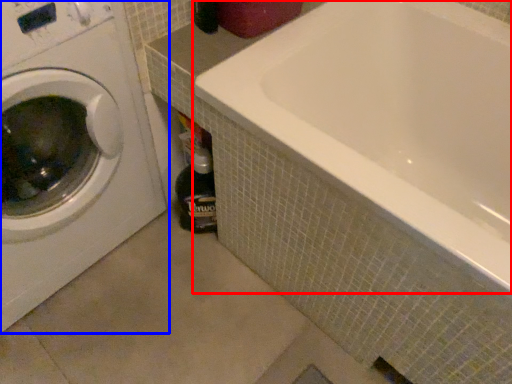
Question: Which object is further to the camera taking this photo, bathtub (highlighted by a red box) or washing machine (highlighted by a blue box)?

Choices:
 (A) bathtub
 (B) washing machine

Answer: (A)